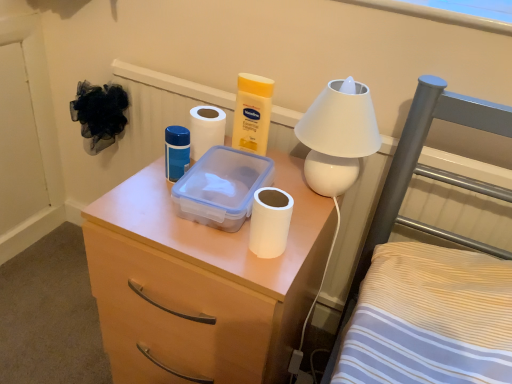
Locate an element on the screen. The height and width of the screenshot is (384, 512). free space that is to the left of white matte toilet paper at center, which is the 1th toilet paper in front-to-back order is located at coordinates (189, 233).